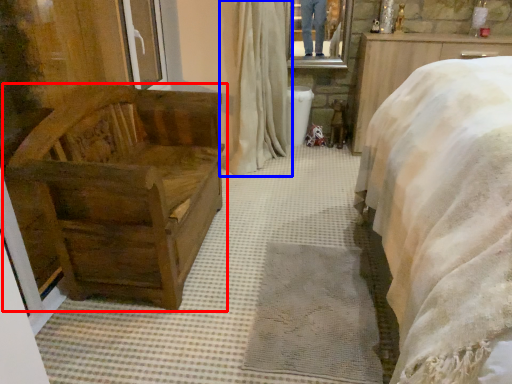
Question: Among these objects, which one is farthest to the camera, furniture (highlighted by a red box) or curtain (highlighted by a blue box)?

Choices:
 (A) furniture
 (B) curtain

Answer: (B)